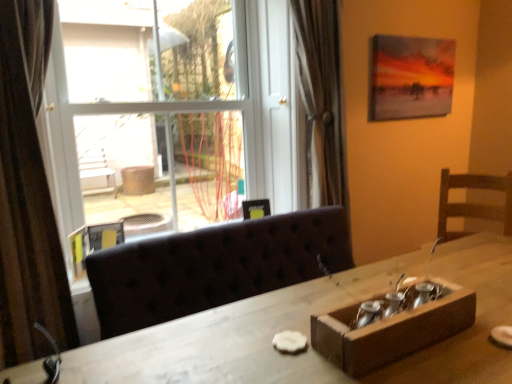
Where is `vacant region to the left of wooden box at lower right`? The image size is (512, 384). vacant region to the left of wooden box at lower right is located at coordinates (269, 338).